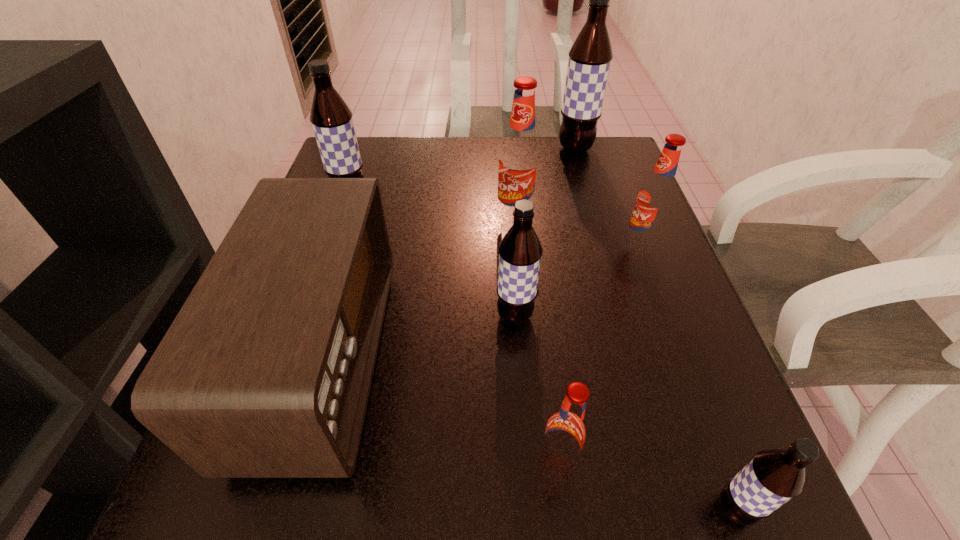
Locate an element on the screen. This screenshot has width=960, height=540. the nearest red root beer is located at coordinates (566, 432).

The height and width of the screenshot is (540, 960). Identify the location of the second nearest root beer. (566, 432).

Find the location of a particular element. The height and width of the screenshot is (540, 960). the smallest brown root beer is located at coordinates [x=774, y=476].

This screenshot has height=540, width=960. In order to click on the nearest root beer in this screenshot , I will do `click(774, 476)`.

The width and height of the screenshot is (960, 540). I want to click on vacant region located 0.210m on the left of the farthest brown root beer, so click(476, 148).

You are a GUI agent. You are given a task and a screenshot of the screen. Output one action in this format:
    pyautogui.click(x=<x>, y=<y>)
    Task: Click on the free space located on the front of the biggest red root beer
    
    Given the screenshot: What is the action you would take?
    pyautogui.click(x=523, y=298)

I want to click on vacant area situated 0.130m on the back of the leftmost brown root beer, so [365, 158].

Where is `vacant space positioned 0.190m on the back of the second nearest red root beer`? The height and width of the screenshot is (540, 960). vacant space positioned 0.190m on the back of the second nearest red root beer is located at coordinates (616, 183).

The height and width of the screenshot is (540, 960). In order to click on free location located on the left of the third brown root beer from right to left in this screenshot , I will do `click(381, 316)`.

At what (x,y) coordinates should I click in order to perform the action: click on free space located 0.320m on the front-facing side of the radio receiver. Please return your answer as a coordinate pair (x, y). This screenshot has width=960, height=540. Looking at the image, I should click on (578, 357).